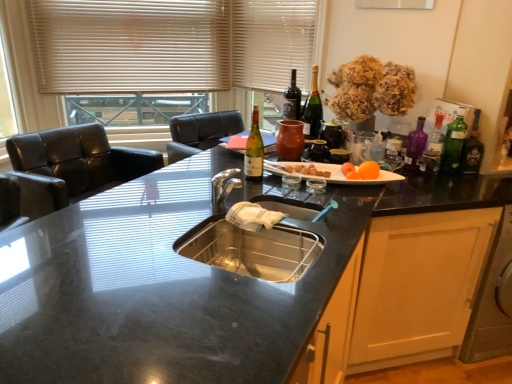
What do you see at coordinates (361, 171) in the screenshot? I see `orange matte at upper right` at bounding box center [361, 171].

At what (x,y) coordinates should I click in order to perform the action: click on matte glass wine bottle at upper right. Please return your answer as a coordinate pair (x, y). Looking at the image, I should click on (312, 109).

What do you see at coordinates (228, 285) in the screenshot?
I see `black granite countertop at center` at bounding box center [228, 285].

Describe the element at coordinates (254, 150) in the screenshot. I see `matte glass wine bottle at center, acting as the 1th bottle starting from the front` at that location.

Find the location of a particular element. matte glass wine bottle at center, the fifth bottle positioned from the front is located at coordinates (292, 100).

Are matte glass wine bottle at upper right and white fabric curtain at upper center beside each other?

matte glass wine bottle at upper right is not next to white fabric curtain at upper center, and they're not touching.

Does matte glass wine bottle at upper right have a greater width compared to white fabric curtain at upper center?

Yes.

From a real-world perspective, is matte glass wine bottle at upper right on top of white fabric curtain at upper center?

No.

I want to click on wine bottle that is under the white fabric curtain at upper center (from a real-world perspective), so click(x=312, y=109).

Is matte glass wine bottle at upper right at the back of green glass bottle at right, the 2th bottle positioned from the right?

No, matte glass wine bottle at upper right is not at the back of green glass bottle at right, the 2th bottle positioned from the right.

Looking at the image, does green glass bottle at right, the fourth bottle from the left, seem bigger or smaller compared to matte glass wine bottle at upper right?

Considering their sizes, green glass bottle at right, the fourth bottle from the left, takes up less space than matte glass wine bottle at upper right.

From a real-world perspective, is green glass bottle at right, placed as the second bottle when sorted from front to back, below matte glass wine bottle at upper right?

Yes, from a real-world perspective, green glass bottle at right, placed as the second bottle when sorted from front to back, is under matte glass wine bottle at upper right.

Is matte glass wine bottle at upper right taller or shorter than orange matte at upper center?

Clearly, matte glass wine bottle at upper right is taller compared to orange matte at upper center.

Is point (312, 131) closer or farther from the camera than point (345, 167)?

Point (312, 131).

Locate an element on the screen. wine bottle that appears on the left of orange matte at upper center is located at coordinates pyautogui.click(x=312, y=109).

From the image's perspective, which one is positioned higher, beige blinds at upper left or white fabric curtain at upper center?

white fabric curtain at upper center is shown above in the image.

Identify the location of curtain located above the beige blinds at upper left (from the image's perspective). (273, 43).

Which object is wider, beige blinds at upper left or white fabric curtain at upper center?

Wider between the two is white fabric curtain at upper center.

Is beige blinds at upper left situated inside white fabric curtain at upper center or outside?

beige blinds at upper left is not inside white fabric curtain at upper center, it's outside.

Find the location of a particular element. The height and width of the screenshot is (384, 512). the 4th bottle behind the matte glass wine bottle at center, which ranks as the 1th bottle in left-to-right order, counting from the anchor's position is located at coordinates (292, 100).

From the image's perspective, does matte glass wine bottle at center, which ranks as the 1th bottle in left-to-right order, appear lower than matte glass wine bottle at center, which appears as the second bottle when viewed from the left?

Correct, matte glass wine bottle at center, which ranks as the 1th bottle in left-to-right order, appears lower than matte glass wine bottle at center, which appears as the second bottle when viewed from the left, in the image.

Who is smaller, matte glass wine bottle at center, positioned as the fifth bottle in back-to-front order, or matte glass wine bottle at center, which is the 4th bottle in right-to-left order?

matte glass wine bottle at center, positioned as the fifth bottle in back-to-front order.

Considering the relative sizes of matte glass wine bottle at center, acting as the 1th bottle starting from the front, and matte glass wine bottle at center, which appears as the second bottle when viewed from the left, in the image provided, is matte glass wine bottle at center, acting as the 1th bottle starting from the front, thinner than matte glass wine bottle at center, which appears as the second bottle when viewed from the left,?

Correct, the width of matte glass wine bottle at center, acting as the 1th bottle starting from the front, is less than that of matte glass wine bottle at center, which appears as the second bottle when viewed from the left.

From the image's perspective, is green glass bottle at right, the 5th bottle viewed from the left, beneath beige blinds at upper left?

Indeed, from the image's perspective, green glass bottle at right, the 5th bottle viewed from the left, is shown beneath beige blinds at upper left.

Is green glass bottle at right, which ranks as the 2th bottle in back-to-front order, placed right next to beige blinds at upper left?

No, green glass bottle at right, which ranks as the 2th bottle in back-to-front order, is not making contact with beige blinds at upper left.

Can you tell me how much green glass bottle at right, marked as the 4th bottle in a front-to-back arrangement, and beige blinds at upper left differ in facing direction?

The facing directions of green glass bottle at right, marked as the 4th bottle in a front-to-back arrangement, and beige blinds at upper left are 6.78 degrees apart.

Which of these two, green glass bottle at right, the 5th bottle viewed from the left, or black granite countertop at center, is smaller?

With smaller size is green glass bottle at right, the 5th bottle viewed from the left.

From the image's perspective, is green glass bottle at right, the 5th bottle viewed from the left, over black granite countertop at center?

Yes.

Is green glass bottle at right, the 5th bottle viewed from the left, looking in the opposite direction of black granite countertop at center?

green glass bottle at right, the 5th bottle viewed from the left, does not have its back to black granite countertop at center.

Between point (462, 166) and point (143, 303), which one is positioned behind?

Point (462, 166)

Locate an element on the screen. curtain behind the matte glass wine bottle at upper right is located at coordinates (273, 43).

Find the location of a particular element. wine bottle above the green glass bottle at right, placed as the second bottle when sorted from front to back (from the image's perspective) is located at coordinates pos(312,109).

Estimate the real-world distances between objects in this image. Which object is closer to matte glass wine bottle at upper right, black granite countertop at center or matte glass wine bottle at center, positioned as the 1th bottle in back-to-front order?

matte glass wine bottle at center, positioned as the 1th bottle in back-to-front order.

Looking at the image, which one is located further to orange matte at upper right, green glass bottle at right, the fourth bottle from the left, or matte glass wine bottle at center, which is the 4th bottle in right-to-left order?

matte glass wine bottle at center, which is the 4th bottle in right-to-left order.

Based on their spatial positions, is black granite countertop at center or matte glass wine bottle at center, positioned as the 1th bottle in back-to-front order, closer to white fabric curtain at upper center?

The object closer to white fabric curtain at upper center is matte glass wine bottle at center, positioned as the 1th bottle in back-to-front order.

Based on their spatial positions, is matte glass wine bottle at center, the fifth bottle positioned from the front, or white fabric curtain at upper center further from matte glass wine bottle at upper right?

Among the two, white fabric curtain at upper center is located further to matte glass wine bottle at upper right.

Considering their positions, is matte glass wine bottle at center, positioned as the 1th bottle in back-to-front order, positioned further to white fabric curtain at upper center than matte glass wine bottle at upper right?

matte glass wine bottle at upper right lies further to white fabric curtain at upper center than the other object.

Based on their spatial positions, is purple glass bottle at right, the third bottle positioned from the right, or white fabric curtain at upper center closer to black granite countertop at center?

The object closer to black granite countertop at center is purple glass bottle at right, the third bottle positioned from the right.

Estimate the real-world distances between objects in this image. Which object is further from matte glass wine bottle at upper right, matte glass wine bottle at center, acting as the 1th bottle starting from the front, or orange matte at upper right?

matte glass wine bottle at center, acting as the 1th bottle starting from the front, is further to matte glass wine bottle at upper right.

When comparing their distances from green glass bottle at right, the 2th bottle positioned from the right, does green glass bottle at right, which ranks as the 2th bottle in back-to-front order, or purple glass bottle at right, which ranks as the third bottle in back-to-front order, seem closer?

green glass bottle at right, which ranks as the 2th bottle in back-to-front order, is positioned closer to the anchor green glass bottle at right, the 2th bottle positioned from the right.

Locate an element on the screen. The image size is (512, 384). wine bottle situated between matte glass wine bottle at center, acting as the 1th bottle starting from the front, and green glass bottle at right, which is the 1th bottle in right-to-left order, from left to right is located at coordinates (312, 109).

Locate an element on the screen. fruit between matte glass wine bottle at center, which appears as the fifth bottle when viewed from the right, and green glass bottle at right, the 5th bottle viewed from the left is located at coordinates (361, 171).

Where is `curtain positioned between black granite countertop at center and beige blinds at upper left from near to far`? The width and height of the screenshot is (512, 384). curtain positioned between black granite countertop at center and beige blinds at upper left from near to far is located at coordinates (273, 43).

Identify the location of wine bottle situated between beige blinds at upper left and green glass bottle at right, the fourth bottle from the left, from left to right. (312, 109).